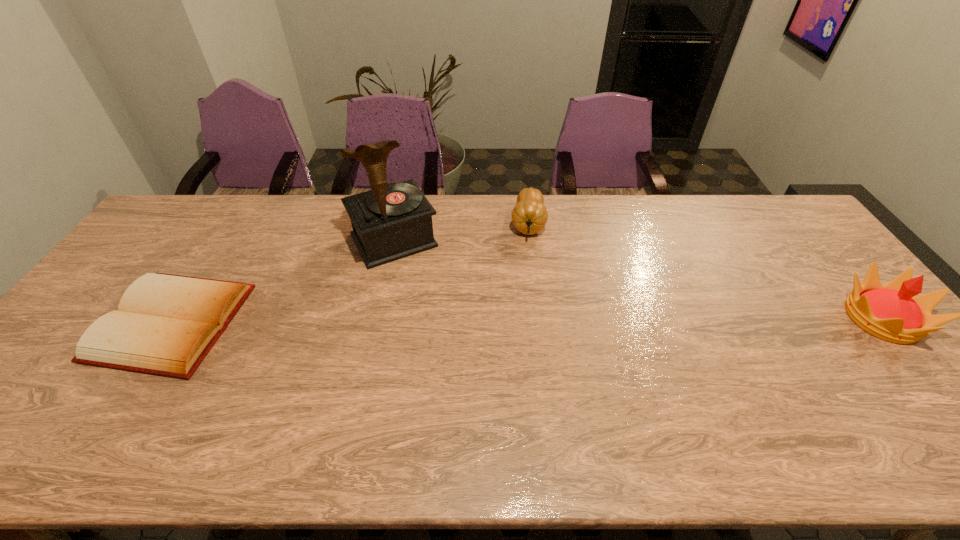
The height and width of the screenshot is (540, 960). What are the coordinates of `free space between the Bible and the second tallest object` in the screenshot? It's located at (527, 320).

The height and width of the screenshot is (540, 960). Identify the location of empty location between the third tallest object and the crown. (705, 271).

The image size is (960, 540). Find the location of `free space between the phonograph_record and the second tallest object`. free space between the phonograph_record and the second tallest object is located at coordinates (637, 279).

Where is `the second closest object to the phonograph_record`? The height and width of the screenshot is (540, 960). the second closest object to the phonograph_record is located at coordinates (529, 215).

Locate an element on the screen. The image size is (960, 540). object identified as the closest to the crown is located at coordinates (529, 215).

Where is `vacant region that satisfies the following two spatial constraints: 1. on the front side of the second object from right to left; 2. on the right side of the crown`? Image resolution: width=960 pixels, height=540 pixels. vacant region that satisfies the following two spatial constraints: 1. on the front side of the second object from right to left; 2. on the right side of the crown is located at coordinates (539, 319).

At what (x,y) coordinates should I click in order to perform the action: click on blank space that satisfies the following two spatial constraints: 1. on the back side of the third object from left to right; 2. on the left side of the phonograph_record. Please return your answer as a coordinate pair (x, y). The height and width of the screenshot is (540, 960). Looking at the image, I should click on (397, 224).

This screenshot has height=540, width=960. Identify the location of free space that satisfies the following two spatial constraints: 1. on the back side of the third tallest object; 2. on the left side of the third object from right to left. (397, 224).

The height and width of the screenshot is (540, 960). In order to click on free spot that satisfies the following two spatial constraints: 1. on the back side of the tallest object; 2. on the left side of the shortest object in this screenshot , I will do `click(224, 240)`.

Where is `vacant region that satisfies the following two spatial constraints: 1. on the back side of the tallest object; 2. on the left side of the Bible`? This screenshot has height=540, width=960. vacant region that satisfies the following two spatial constraints: 1. on the back side of the tallest object; 2. on the left side of the Bible is located at coordinates (224, 240).